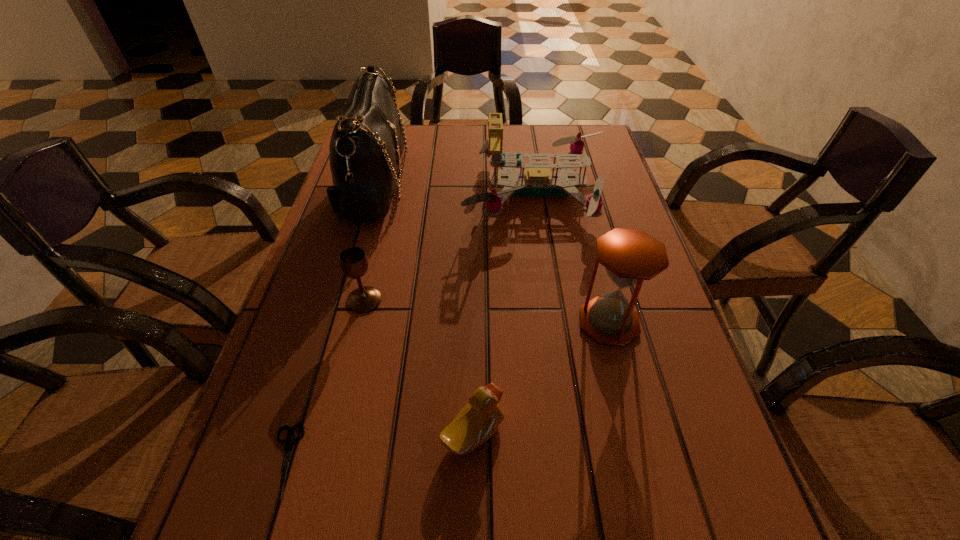
The image size is (960, 540). What are the coordinates of `handbag` in the screenshot? It's located at (367, 143).

I want to click on drone, so click(538, 180).

At what (x,y) coordinates should I click in order to perform the action: click on hourglass. Please return your answer as a coordinate pair (x, y). The image size is (960, 540). Looking at the image, I should click on (629, 256).

Where is `chalice`? The width and height of the screenshot is (960, 540). chalice is located at coordinates (353, 260).

At what (x,y) coordinates should I click in order to perform the action: click on the fifth tallest object. Please return your answer as a coordinate pair (x, y). Looking at the image, I should click on (479, 419).

At what (x,y) coordinates should I click in order to perform the action: click on the shortest object. Please return your answer as a coordinate pair (x, y). This screenshot has height=540, width=960. Looking at the image, I should click on click(288, 442).

This screenshot has height=540, width=960. I want to click on vacant area located 0.250m at the front of the tallest object with chain and zipper, so click(499, 187).

At what (x,y) coordinates should I click in order to perform the action: click on free space located on the front-facing side of the drone. Please return your answer as a coordinate pair (x, y). This screenshot has width=960, height=540. Looking at the image, I should click on (364, 191).

Locate an element on the screen. The height and width of the screenshot is (540, 960). vacant space located 0.210m on the front-facing side of the drone is located at coordinates (386, 191).

This screenshot has height=540, width=960. Identify the location of blank space located on the front-facing side of the drone. (412, 191).